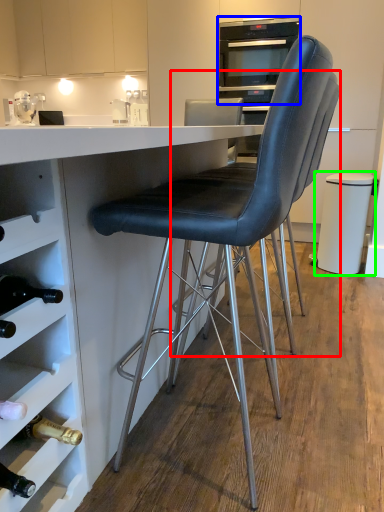
Question: Considering the real-world distances, which object is farthest from chair (highlighted by a red box)? home appliance (highlighted by a blue box) or bar stool (highlighted by a green box)?

Choices:
 (A) home appliance
 (B) bar stool

Answer: (A)